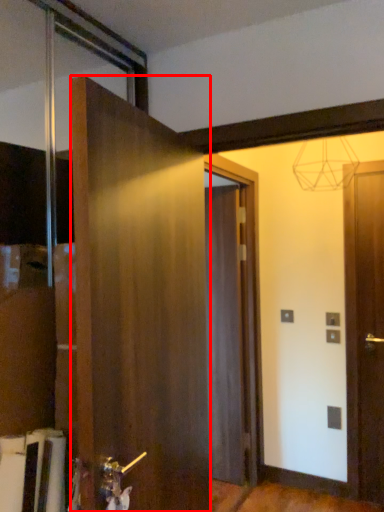
Question: Observing the image, what is the correct spatial positioning of door (annotated by the red box) in reference to door?

Choices:
 (A) right
 (B) left

Answer: (B)